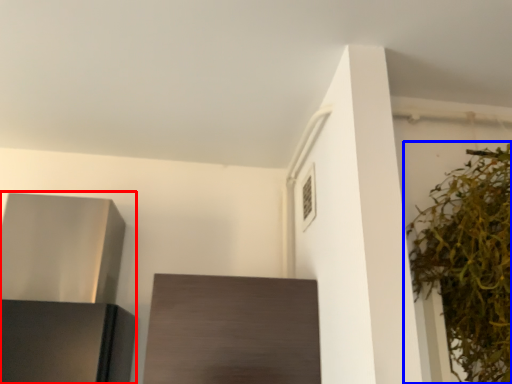
Question: Among these objects, which one is farthest to the camera, appliance (highlighted by a red box) or houseplant (highlighted by a blue box)?

Choices:
 (A) appliance
 (B) houseplant

Answer: (A)